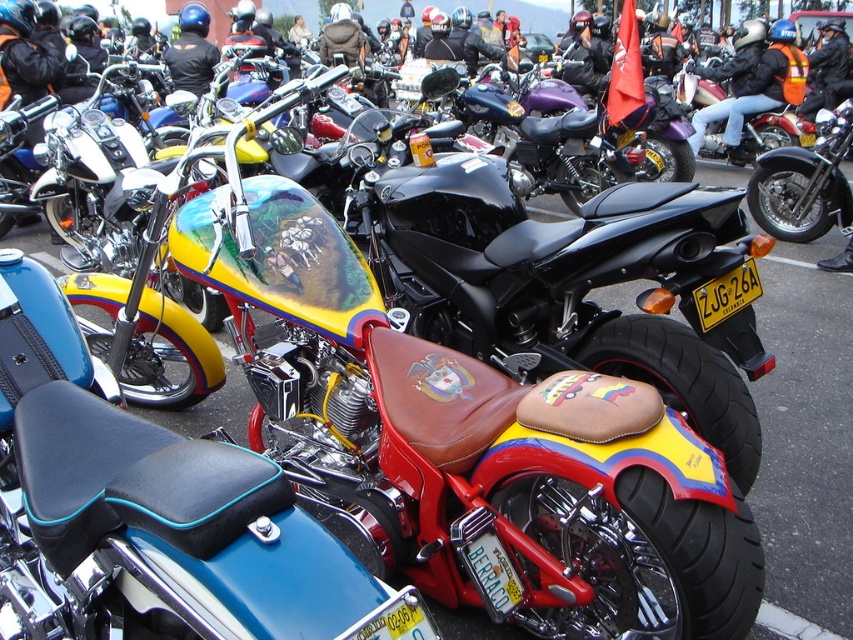
Does shiny chrome engine at center have a larger size compared to matte black motorcycle at center?

No, shiny chrome engine at center is not bigger than matte black motorcycle at center.

Is shiny chrome engine at center to the right of matte black motorcycle at center from the viewer's perspective?

In fact, shiny chrome engine at center is to the left of matte black motorcycle at center.

Is point (251, 484) positioned in front of point (741, 116)?

Yes, it is.

Where is `shiny chrome engine at center`? shiny chrome engine at center is located at coordinates (154, 516).